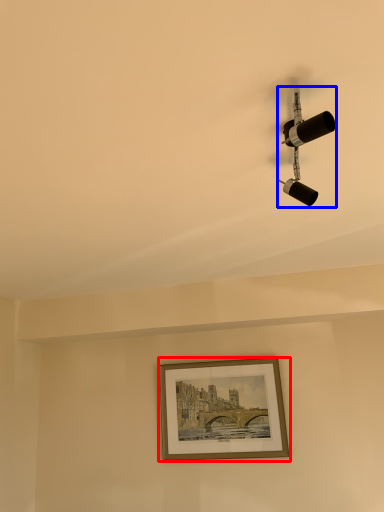
Question: Which point is closer to the camera, picture frame (highlighted by a red box) or lamp (highlighted by a blue box)?

Choices:
 (A) picture frame
 (B) lamp

Answer: (B)